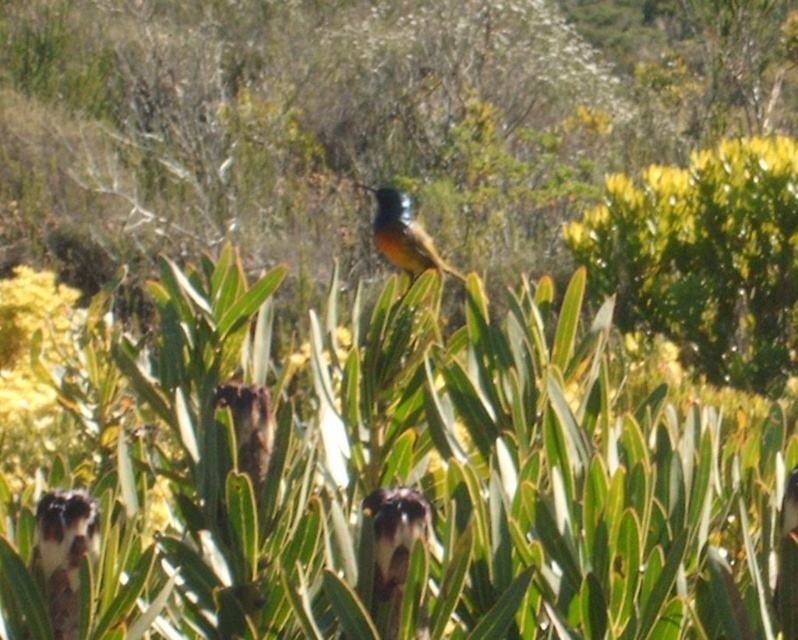
Looking at this image, between green leafy bush at upper right and shiny blue bird at center, which one is positioned lower?

Positioned lower is shiny blue bird at center.

Between green leafy bush at upper right and shiny blue bird at center, which one appears on the left side from the viewer's perspective?

shiny blue bird at center

This screenshot has width=798, height=640. What do you see at coordinates (704, 257) in the screenshot?
I see `green leafy bush at upper right` at bounding box center [704, 257].

The width and height of the screenshot is (798, 640). I want to click on green leafy bush at upper right, so click(x=704, y=257).